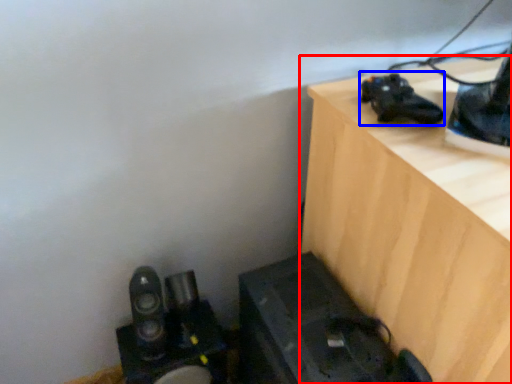
Question: Which object is closer to the camera taking this photo, furniture (highlighted by a red box) or shoe (highlighted by a blue box)?

Choices:
 (A) furniture
 (B) shoe

Answer: (A)